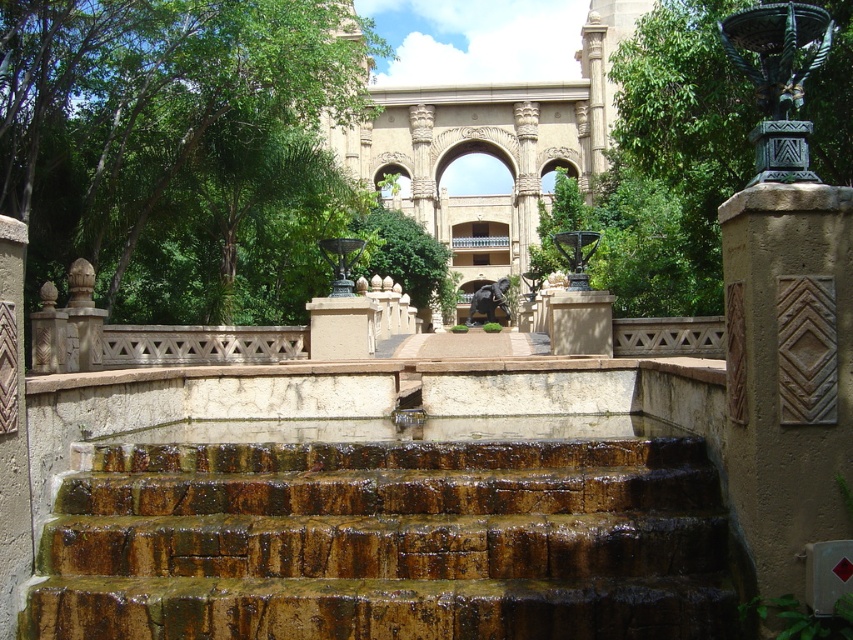
You are standing on the brown textured stone at right and want to walk towards the sandstone archway at center. Which direction should you move to reach it?

The brown textured stone at right is located below the sandstone archway at center, so you should move upward to reach the sandstone archway at center.